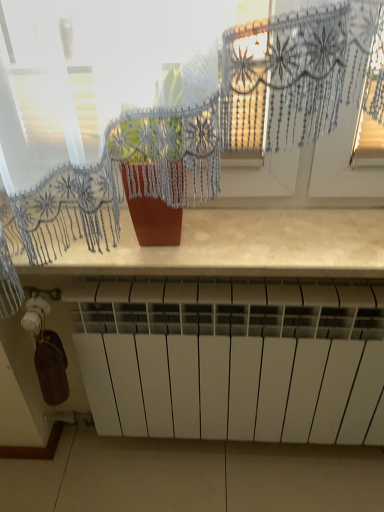
Question: Does point (314, 174) appear closer or farther from the camera than point (251, 214)?

Choices:
 (A) farther
 (B) closer

Answer: (B)

Question: Which is correct: transparent lace curtain at upper center is inside matte brown countertop at center, or outside of it?

Choices:
 (A) inside
 (B) outside

Answer: (B)

Question: Which of these objects is positioned farthest from the white matte radiator at lower center?

Choices:
 (A) matte brown countertop at center
 (B) transparent lace curtain at upper center

Answer: (B)

Question: Which object is positioned closest to the white matte radiator at lower center?

Choices:
 (A) transparent lace curtain at upper center
 (B) matte brown countertop at center

Answer: (B)